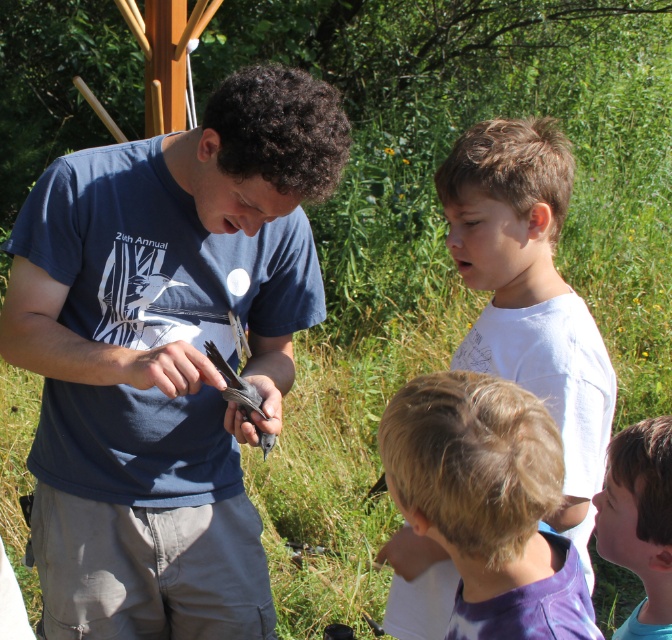
Question: Which of the following is the farthest from the observer?

Choices:
 (A) matte blue shirt at center
 (B) blonde hair at lower center
 (C) white cotton shirt at upper right
 (D) blue tie-dye shirt at lower right

Answer: (A)

Question: Among these points, which one is farthest from the camera?

Choices:
 (A) (663, 515)
 (B) (401, 390)
 (C) (257, 547)

Answer: (C)

Question: Does white cotton shirt at upper right appear under blue tie-dye shirt at lower right?

Choices:
 (A) no
 (B) yes

Answer: (A)

Question: Is blonde hair at lower center bigger than blue tie-dye shirt at lower right?

Choices:
 (A) no
 (B) yes

Answer: (B)

Question: Which object is the farthest from the blue tie-dye shirt at lower right?

Choices:
 (A) matte blue shirt at center
 (B) blonde hair at lower center
 (C) white cotton shirt at upper right

Answer: (A)

Question: Is white cotton shirt at upper right smaller than blue tie-dye shirt at lower right?

Choices:
 (A) no
 (B) yes

Answer: (A)